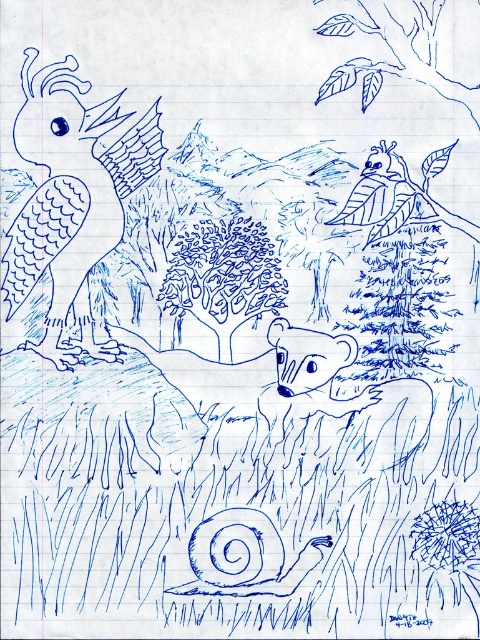
Question: Which point is farther from the camera taking this photo?

Choices:
 (A) (475, 122)
 (B) (386, 193)
 (C) (32, 269)

Answer: (B)

Question: Is matte blue bird at upper left smaller than blue sketchy bird at upper center?

Choices:
 (A) yes
 (B) no

Answer: (B)

Question: Which of the following is the closest to the observer?

Choices:
 (A) blue sketchy bird at upper center
 (B) matte blue bird at upper left

Answer: (B)

Question: Does matte blue bird at upper left have a lesser width compared to blue line art tree at upper center?

Choices:
 (A) no
 (B) yes

Answer: (B)

Question: Which point is farther to the camera?

Choices:
 (A) matte blue bird at upper left
 (B) blue sketchy bird at upper center
 (C) blue line art tree at upper center

Answer: (B)

Question: Can you confirm if blue line art tree at upper center is positioned to the right of blue sketchy bird at upper center?

Choices:
 (A) no
 (B) yes

Answer: (A)